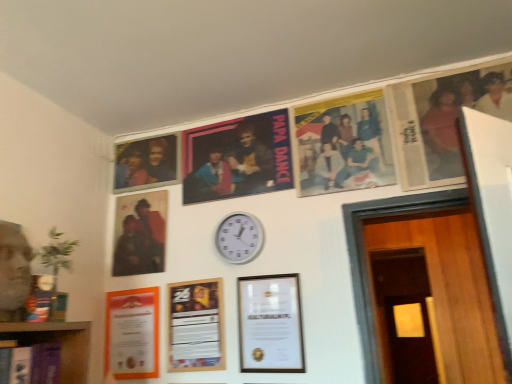
Question: From the image's perspective, is wooden door at lower right positioned above or below matte plastic photo frame at upper left, which ranks as the third picture frame in left-to-right order?

Choices:
 (A) below
 (B) above

Answer: (A)

Question: In the image, is wooden door at lower right positioned in front of or behind matte plastic photo frame at upper left, the 4th picture frame positioned from the right?

Choices:
 (A) front
 (B) behind

Answer: (B)

Question: Considering the real-world distances, which object is farthest from the matte plastic photo frame at upper right, which is the first picture frame from right to left?

Choices:
 (A) wooden picture frame at center, marked as the 2th picture frame in a right-to-left arrangement
 (B) wooden framed poster at center, which ranks as the third picture frame in right-to-left order
 (C) wooden door at lower right
 (D) printed paper poster at upper center, which ranks as the 2th poster in left-to-right order
 (E) matte orange certificate at lower left, which is the 2th picture frame from left to right

Answer: (C)

Question: Estimate the real-world distances between objects in this image. Which object is closer to the matte plastic photo frame at upper right, arranged as the sixth picture frame when viewed from the left?

Choices:
 (A) wooden door at lower right
 (B) wooden picture frame at center, marked as the 2th picture frame in a right-to-left arrangement
 (C) matte paper poster at upper center, marked as the 1th poster in a left-to-right arrangement
 (D) matte plastic photo frame at upper left, the 4th picture frame positioned from the right
 (E) white plastic wall clock at center

Answer: (C)